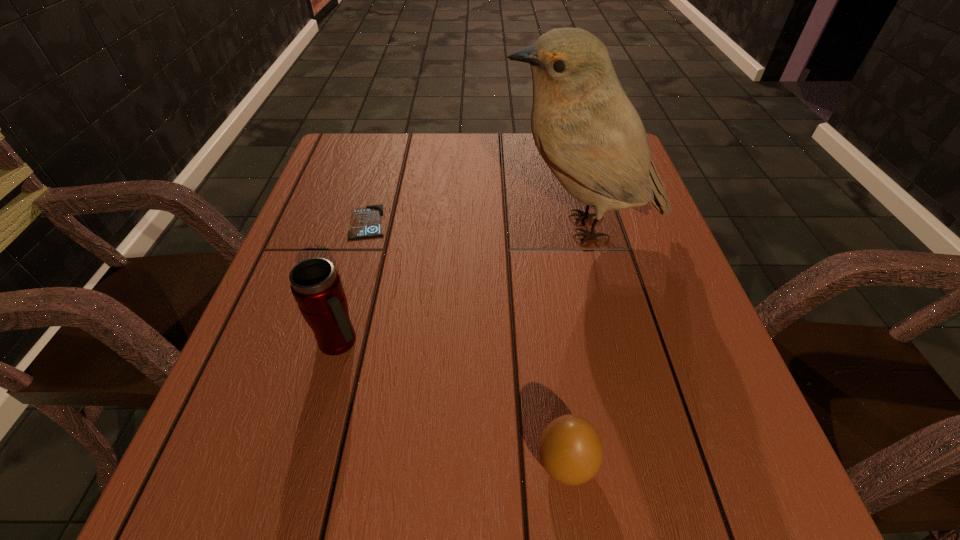
This screenshot has width=960, height=540. Identify the location of the tallest object. (585, 128).

At what (x,y) coordinates should I click in order to perform the action: click on thermos bottle. Please return your answer as a coordinate pair (x, y). This screenshot has height=540, width=960. Looking at the image, I should click on (316, 286).

Locate an element on the screen. The height and width of the screenshot is (540, 960). the third farthest object is located at coordinates (316, 286).

Where is `the third tallest object`? The image size is (960, 540). the third tallest object is located at coordinates (571, 451).

I want to click on boiled egg, so click(x=571, y=451).

This screenshot has width=960, height=540. I want to click on the shortest object, so click(x=366, y=222).

Locate an element on the screen. The image size is (960, 540). free space located 0.190m on the face of the tallest object is located at coordinates (415, 227).

Find the location of a particular element. The image size is (960, 540). vacant space located on the face of the tallest object is located at coordinates (468, 227).

Where is `vacant area situated 0.250m on the face of the tallest object`? vacant area situated 0.250m on the face of the tallest object is located at coordinates (388, 227).

Identify the location of free region located on the side with the handle of the second nearest object. Image resolution: width=960 pixels, height=540 pixels. (432, 342).